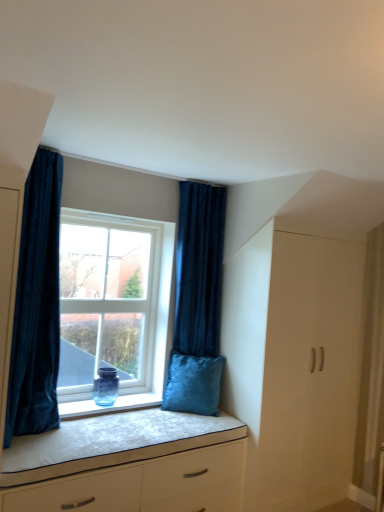
Question: Is white matte chest of drawers at lower center spatially inside velvet dark blue curtain at left, which is the second curtain in back-to-front order, or outside of it?

Choices:
 (A) inside
 (B) outside

Answer: (B)

Question: In the image, is white matte chest of drawers at lower center positioned in front of or behind velvet dark blue curtain at left, which is the first curtain from left to right?

Choices:
 (A) behind
 (B) front

Answer: (B)

Question: Which object is the farthest from the velvet dark blue curtain at right, the 1th curtain viewed from the right?

Choices:
 (A) white matte wardrobe at right
 (B) transparent glass window at center
 (C) velvet blue pillow at window
 (D) velvet dark blue curtain at left, which ranks as the 1th curtain in front-to-back order
 (E) white matte chest of drawers at lower center

Answer: (D)

Question: Estimate the real-world distances between objects in this image. Which object is closer to the velvet dark blue curtain at right, which ranks as the 2th curtain in front-to-back order?

Choices:
 (A) white matte chest of drawers at lower center
 (B) white matte wardrobe at right
 (C) transparent glass window at center
 (D) velvet dark blue curtain at left, which is the second curtain in back-to-front order
 (E) velvet blue pillow at window

Answer: (E)